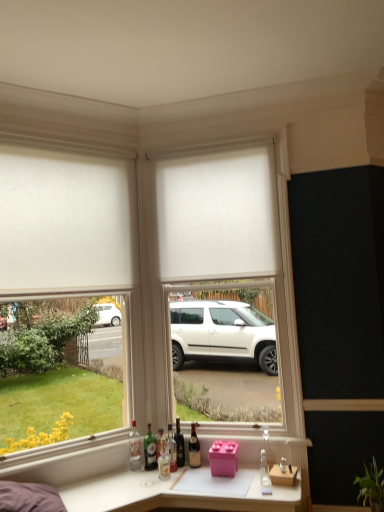
Locate an element on the screen. The width and height of the screenshot is (384, 512). free spot to the right of translucent glass bottle at center, acting as the 4th bottle starting from the right is located at coordinates (192, 472).